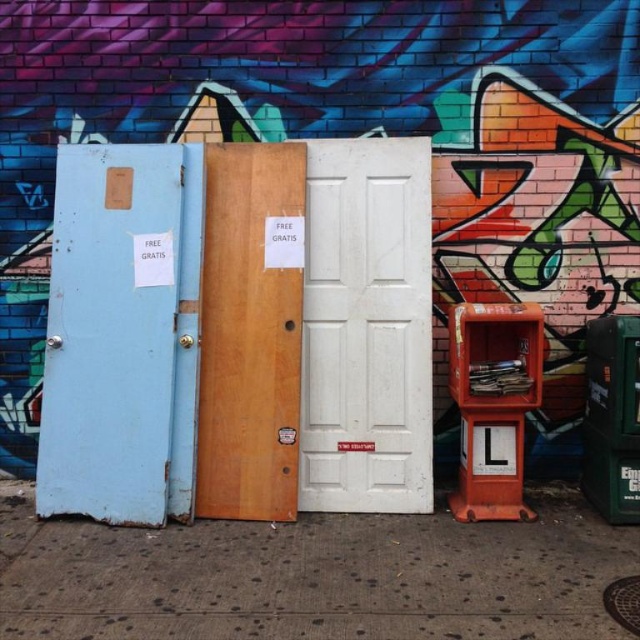
Question: Which object is the closest to the green plastic phone box at right?

Choices:
 (A) rusty metal door at left
 (B) smooth concrete sidewalk at lower center

Answer: (B)

Question: Is wooden door at center below green plastic phone box at right?

Choices:
 (A) yes
 (B) no

Answer: (B)

Question: Can you confirm if rusty metal door at left is wider than wooden door at center?

Choices:
 (A) no
 (B) yes

Answer: (B)

Question: Which object appears closest to the camera in this image?

Choices:
 (A) rusty metal door at left
 (B) wooden door at center
 (C) smooth concrete sidewalk at lower center
 (D) green plastic phone box at right

Answer: (C)

Question: Which object is closer to the camera taking this photo?

Choices:
 (A) green plastic phone box at right
 (B) rusty metal door at left
 (C) white painted wood door at center

Answer: (A)

Question: Is white painted wood door at center positioned in front of green plastic phone box at right?

Choices:
 (A) no
 (B) yes

Answer: (A)